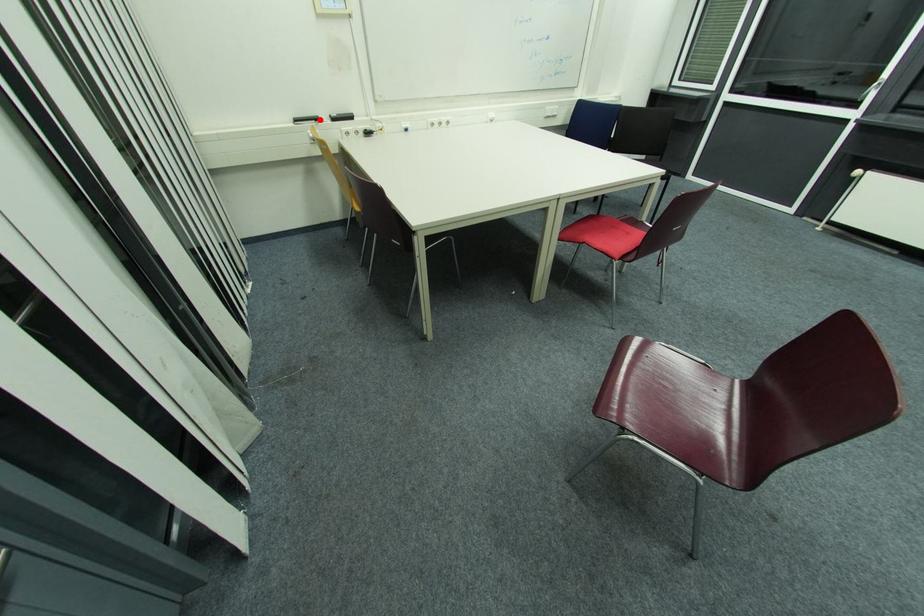
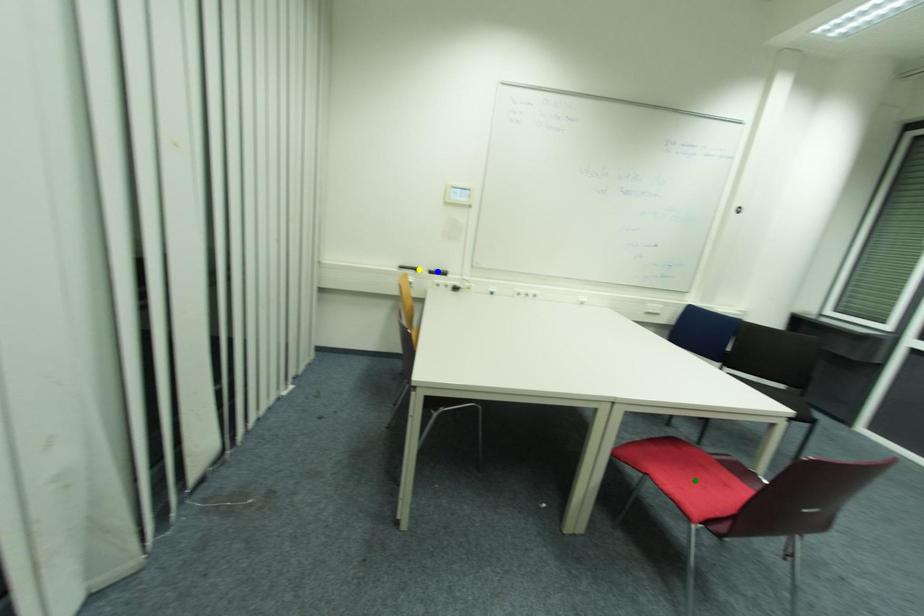
Question: I am providing you with two images of the same scene from different viewpoints. A red point is marked on the first image. You are given multiple points on the second image. Which point in image 2 represents the same 3d spot as the red point in image 1?

Choices:
 (A) green point
 (B) yellow point
 (C) blue point

Answer: (B)